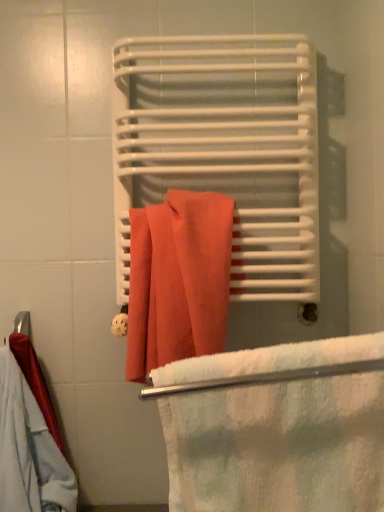
Question: From the image's perspective, is white soft towel at center located beneath matte orange towel at center?

Choices:
 (A) yes
 (B) no

Answer: (A)

Question: From the image's perspective, would you say white soft towel at center is positioned over matte orange towel at center?

Choices:
 (A) yes
 (B) no

Answer: (B)

Question: Is white soft towel at center shorter than matte orange towel at center?

Choices:
 (A) yes
 (B) no

Answer: (A)

Question: From a real-world perspective, is white soft towel at center positioned under matte orange towel at center based on gravity?

Choices:
 (A) no
 (B) yes

Answer: (B)

Question: Does white soft towel at center have a larger size compared to matte orange towel at center?

Choices:
 (A) no
 (B) yes

Answer: (A)

Question: From a real-world perspective, is white soft towel at center on top of matte orange towel at center?

Choices:
 (A) no
 (B) yes

Answer: (A)

Question: Can you confirm if white soft towel at center is bigger than cotton towel at center?

Choices:
 (A) yes
 (B) no

Answer: (A)

Question: Does white soft towel at center have a greater height compared to cotton towel at center?

Choices:
 (A) no
 (B) yes

Answer: (A)

Question: Is white soft towel at center in contact with cotton towel at center?

Choices:
 (A) yes
 (B) no

Answer: (B)

Question: Is white soft towel at center facing away from cotton towel at center?

Choices:
 (A) no
 (B) yes

Answer: (B)

Question: From the image's perspective, is white soft towel at center below cotton towel at center?

Choices:
 (A) yes
 (B) no

Answer: (A)

Question: Does white soft towel at center appear on the left side of cotton towel at center?

Choices:
 (A) yes
 (B) no

Answer: (B)

Question: Does cotton towel at center turn towards white soft towel at center?

Choices:
 (A) yes
 (B) no

Answer: (A)